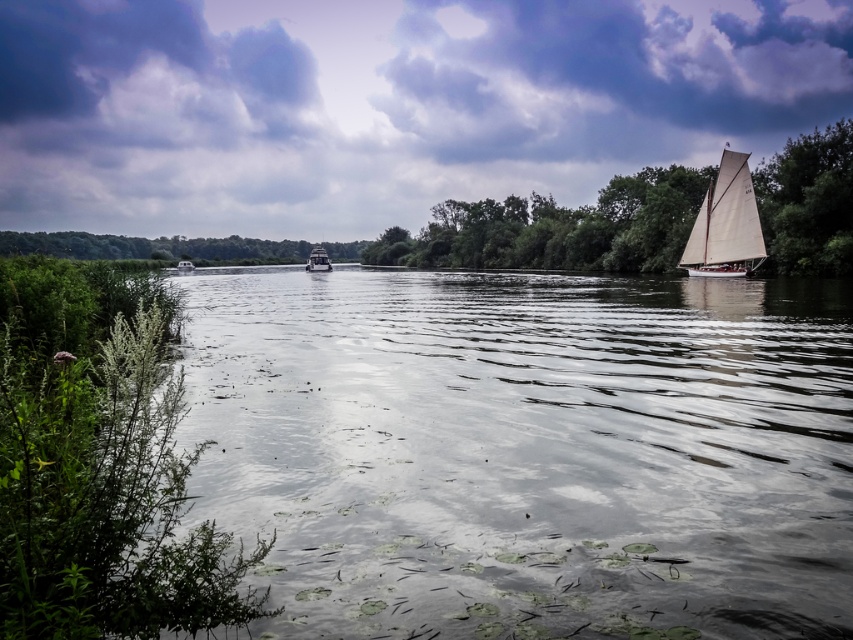
Question: Which of the following is the closest to the observer?

Choices:
 (A) white plastic boat at center
 (B) white canvas sailboat at right

Answer: (B)

Question: Is green leafy trees at right above white canvas sailboat at right?

Choices:
 (A) yes
 (B) no

Answer: (A)

Question: Observing the image, what is the correct spatial positioning of clear water at center in reference to white canvas sailboat at right?

Choices:
 (A) right
 (B) left

Answer: (B)

Question: Which of the following is the closest to the observer?

Choices:
 (A) (190, 262)
 (B) (314, 260)
 (C) (456, 234)
 (D) (351, 433)

Answer: (D)

Question: Which point is farther to the camera?

Choices:
 (A) (730, 276)
 (B) (317, 266)
 (C) (476, 342)
 (D) (177, 264)

Answer: (D)

Question: Is clear water at center below metallic gray boat at center?

Choices:
 (A) no
 (B) yes

Answer: (B)